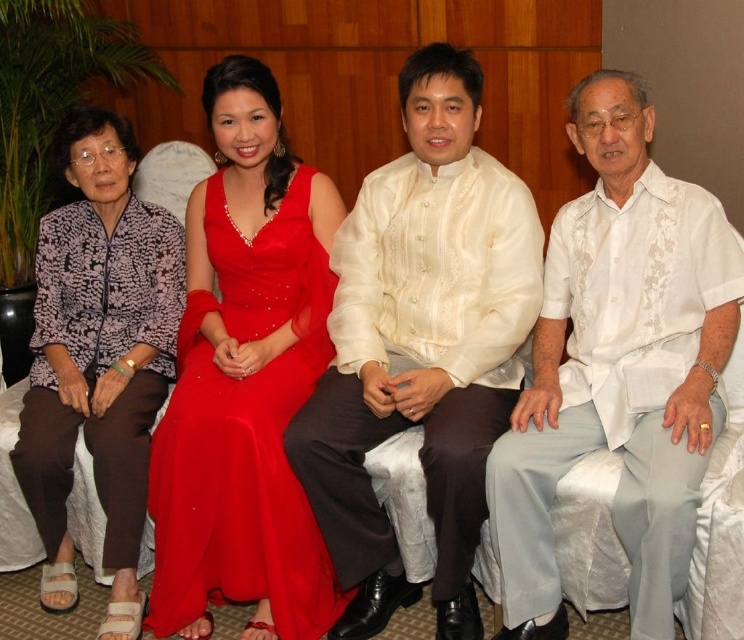
You are a photographer at a formal event. You need to adjust the lighting to ensure both the white textured shirt at right and the printed fabric blouse at left are well lit. Considering their sizes, which one might require more focused lighting to avoid being overshadowed?

The white textured shirt at right is bigger than the printed fabric blouse at left, so it might require more focused lighting to ensure it stands out appropriately in the photograph.

You are a photographer at a formal event. You notice two guests wearing white shirts. One is wearing a white sheer shirt at center and another a white textured shirt at right. Which guest is partially hidden from your view?

The white textured shirt at right is partially hidden because it is positioned behind the white sheer shirt at center.

You are a photographer trying to capture a candid shot of the two individuals in the image. The white textured shirt at right and the printed fabric blouse at left are part of the scene. Based on their positions, which one is higher in the frame?

The white textured shirt at right is located above the printed fabric blouse at left, so it is higher in the frame.